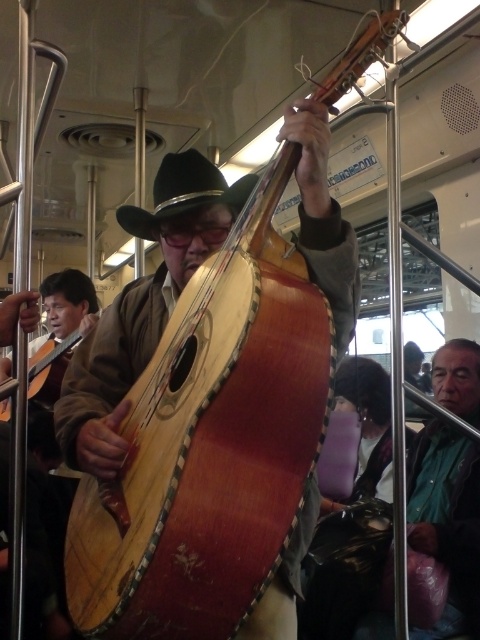
Between wooden carved cello at center and black felt fedora at center, which one has less height?

black felt fedora at center is shorter.

Locate an element on the screen. wooden carved cello at center is located at coordinates (212, 451).